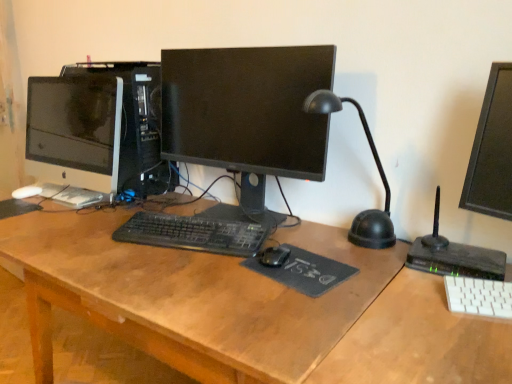
Identify the location of vacant area to the right of black rubber mousepad at center, the 2th mousepad positioned from the front. The image size is (512, 384). (50, 211).